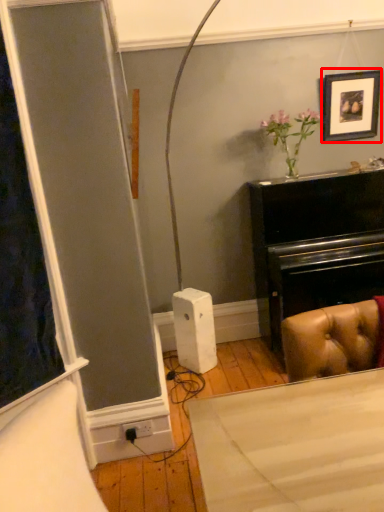
Question: From the image's perspective, what is the correct spatial relationship of picture frame (annotated by the red box) in relation to plug?

Choices:
 (A) below
 (B) above

Answer: (B)